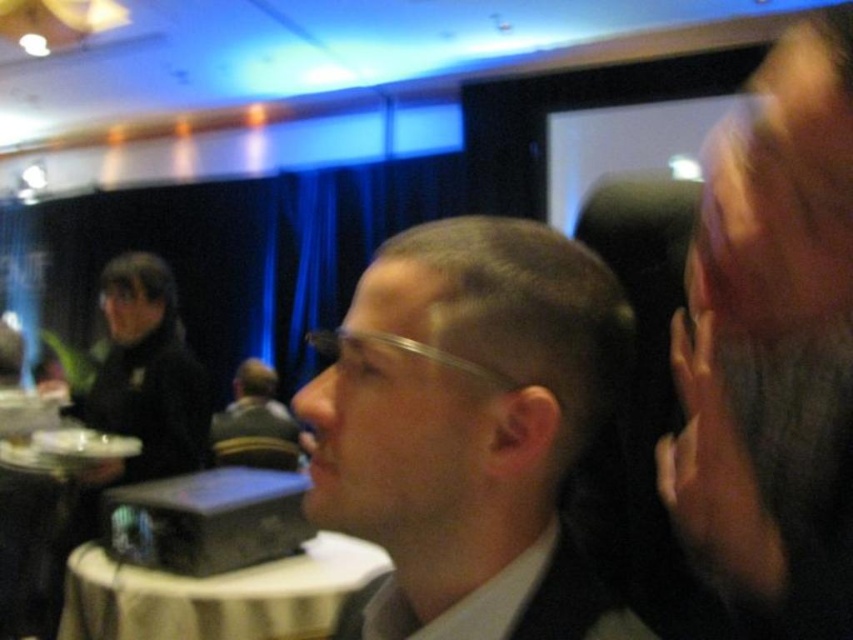
Is dark gray hair at upper right bigger than white cloth-covered table at lower left?

No, dark gray hair at upper right is not bigger than white cloth-covered table at lower left.

Between dark gray hair at upper right and white cloth-covered table at lower left, which one is positioned higher?

Positioned higher is dark gray hair at upper right.

Locate an element on the screen. dark gray hair at upper right is located at coordinates (773, 348).

This screenshot has width=853, height=640. What are the coordinates of `black matte jacket at left` in the screenshot? It's located at (x=146, y=376).

Is point (171, 404) behind point (544, 634)?

Yes, point (171, 404) is behind point (544, 634).

At what (x,y) coordinates should I click in order to perform the action: click on black matte jacket at left. Please return your answer as a coordinate pair (x, y). This screenshot has height=640, width=853. Looking at the image, I should click on (146, 376).

From the picture: Measure the distance between point (630, 620) and camera.

Point (630, 620) is 19.75 inches from camera.

Is matte black suit at center further to the viewer compared to white matte business suit at center?

No, matte black suit at center is closer to the viewer.

Does point (578, 557) lie behind point (450, 637)?

Yes, point (578, 557) is behind point (450, 637).

The height and width of the screenshot is (640, 853). I want to click on matte black suit at center, so click(x=469, y=428).